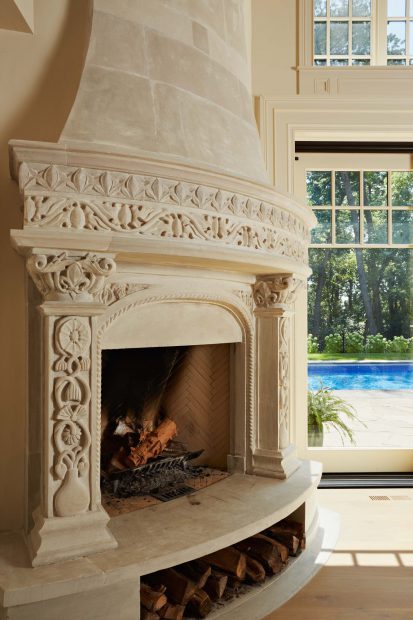
Image resolution: width=413 pixels, height=620 pixels. I want to click on side wall tan, so click(56, 6), click(37, 81), click(12, 358), click(10, 495).